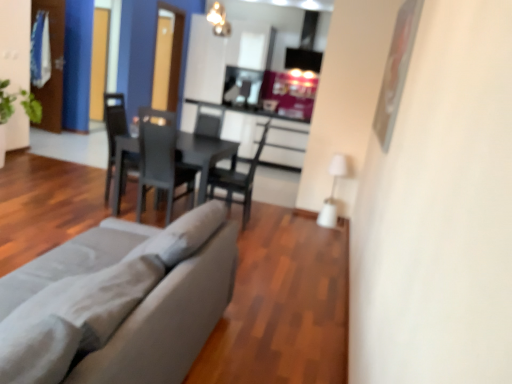
Question: Is matte black chair at center, the 2th chair positioned from the right, in front of or behind transparent glass door at upper left, which is the second glass door in right-to-left order, in the image?

Choices:
 (A) front
 (B) behind

Answer: (A)

Question: Is matte black chair at center, marked as the first chair in a left-to-right arrangement, inside the boundaries of transparent glass door at upper left, which is the 1th glass door in left-to-right order, or outside?

Choices:
 (A) outside
 (B) inside

Answer: (A)

Question: Based on their relative distances, which object is farther from the transparent glass door at upper left, which is the second glass door in right-to-left order?

Choices:
 (A) transparent glass door at upper left, positioned as the 2th glass door in left-to-right order
 (B) matte black chair at center, marked as the first chair in a left-to-right arrangement
 (C) black matte table at center
 (D) matte black armchair at center
 (E) matte gray chair at center, which appears as the 1th chair when viewed from the right

Answer: (E)

Question: Which object is the closest to the gray fabric couch at lower left?

Choices:
 (A) transparent glass door at upper left, positioned as the 2th glass door in left-to-right order
 (B) matte black chair at center, the 2th chair positioned from the right
 (C) black matte table at center
 (D) matte black armchair at center
 (E) matte gray chair at center, the second chair positioned from the left

Answer: (C)